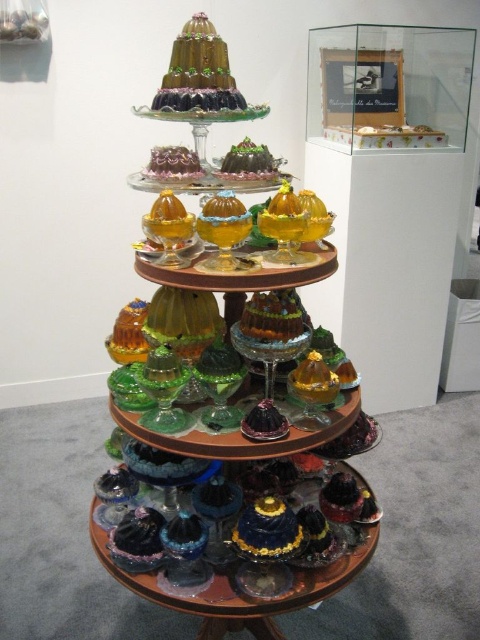
You are a baker who wants to place a new cake on the multi tiered display stand. The new cake is 10 cm wide. Can the shiny chocolate cake at center or the green glossy cake at center accommodate the new cake next to them based on their widths?

The shiny chocolate cake at center might be wider than green glossy cake at center, so the shiny chocolate cake at center has a larger width and can accommodate the new cake next to it.